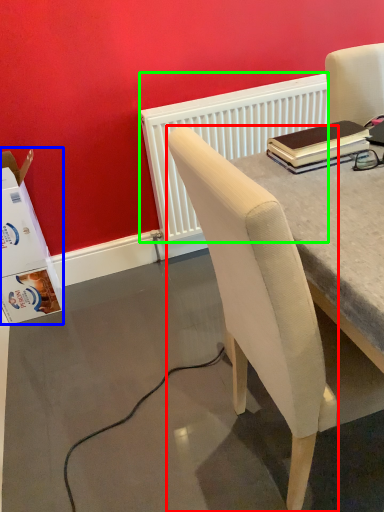
Question: Which object is positioned farthest from chair (highlighted by a red box)? Select from box (highlighted by a blue box) and radiator (highlighted by a green box).

Choices:
 (A) box
 (B) radiator

Answer: (A)